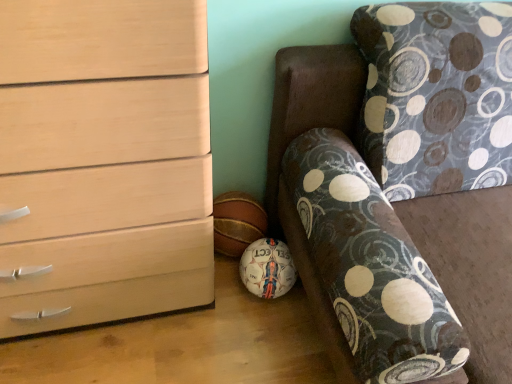
Question: From a real-world perspective, is patterned fabric couch at lower right physically located above or below matte wood chest of drawers at left?

Choices:
 (A) below
 (B) above

Answer: (A)

Question: In terms of height, does patterned fabric couch at lower right look taller or shorter compared to matte wood chest of drawers at left?

Choices:
 (A) tall
 (B) short

Answer: (B)

Question: In terms of size, does patterned fabric couch at lower right appear bigger or smaller than matte wood chest of drawers at left?

Choices:
 (A) big
 (B) small

Answer: (A)

Question: Does point (176, 230) appear closer or farther from the camera than point (504, 324)?

Choices:
 (A) closer
 (B) farther

Answer: (B)

Question: Do you think matte wood chest of drawers at left is within patterned fabric couch at lower right, or outside of it?

Choices:
 (A) outside
 (B) inside

Answer: (A)

Question: In terms of height, does matte wood chest of drawers at left look taller or shorter compared to patterned fabric couch at lower right?

Choices:
 (A) tall
 (B) short

Answer: (A)

Question: From a real-world perspective, is matte wood chest of drawers at left physically located above or below patterned fabric couch at lower right?

Choices:
 (A) above
 (B) below

Answer: (A)